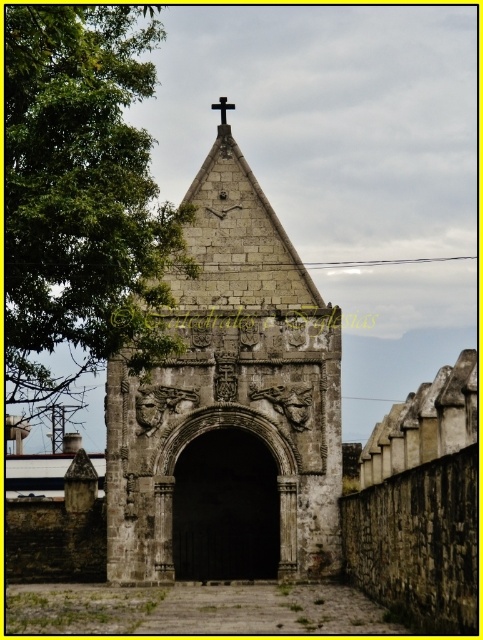
You are standing in front of the historic stone structure and want to take a photo. There are two points marked on the structure at coordinates point (137, 410) and point (128, 33). Which point is closer to your camera lens?

Point (128, 33) is closer to the camera lens because it is not as far as point (137, 410) which is further away.

You are standing in front of the historic stone structure and notice a green leafy tree at left and a black stone cross at top. Which object is located more to the left?

The green leafy tree at left is positioned more to the left side of the black stone cross at top.

You are standing in front of the historic stone structure. You notice the gray stone church at center and the black stone cross at top. Which object is closer to you?

The gray stone church at center is closer to the viewer than the black stone cross at top.